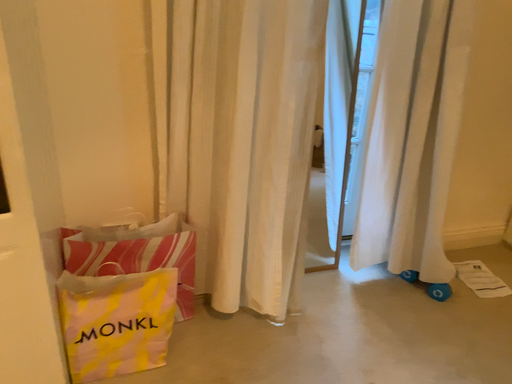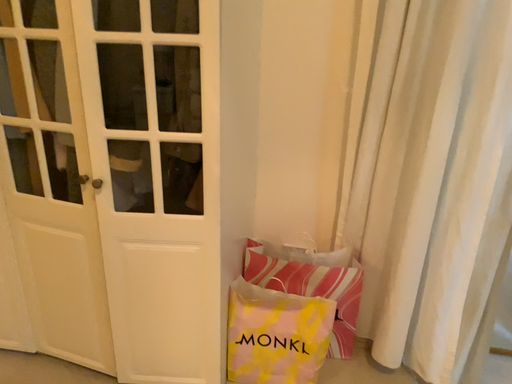
Question: How did the camera likely rotate when shooting the video?

Choices:
 (A) rotated upward
 (B) rotated downward

Answer: (A)